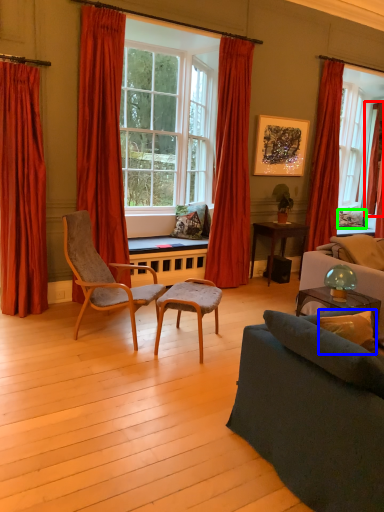
Question: Which is farther away from curtain (highlighted by a red box)? pillow (highlighted by a blue box) or pillow (highlighted by a green box)?

Choices:
 (A) pillow
 (B) pillow

Answer: (A)